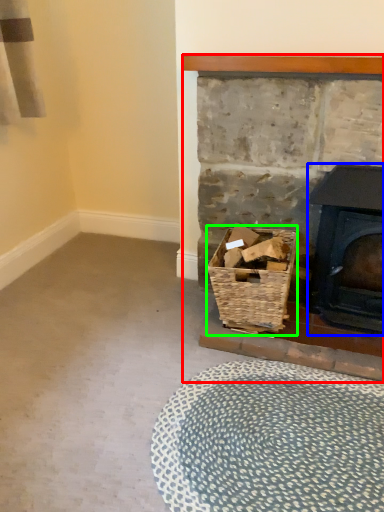
Question: Which is nearer to the fireplace (highlighted by a red box)? wood burning stove (highlighted by a blue box) or basket (highlighted by a green box).

Choices:
 (A) wood burning stove
 (B) basket

Answer: (B)